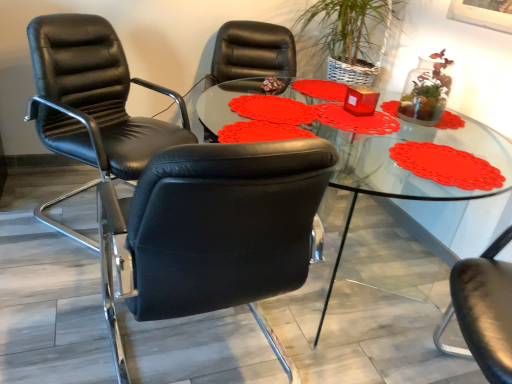
Question: From the image's perspective, is transparent glass table at center beneath black leather chair at left, marked as the first chair in a front-to-back arrangement?

Choices:
 (A) yes
 (B) no

Answer: (B)

Question: Is the surface of transparent glass table at center in direct contact with black leather chair at left, the second chair viewed from the back?

Choices:
 (A) yes
 (B) no

Answer: (B)

Question: Is black leather chair at left, marked as the first chair in a front-to-back arrangement, inside transparent glass table at center?

Choices:
 (A) no
 (B) yes

Answer: (A)

Question: From a real-world perspective, does transparent glass table at center sit lower than black leather chair at left, marked as the first chair in a front-to-back arrangement?

Choices:
 (A) yes
 (B) no

Answer: (A)

Question: Is transparent glass table at center at the right side of black leather chair at left, the second chair viewed from the back?

Choices:
 (A) yes
 (B) no

Answer: (A)

Question: Based on their positions, is black leather chair at left, which is the 2th chair from front to back, located to the left or right of black leather chair at left, marked as the first chair in a front-to-back arrangement?

Choices:
 (A) left
 (B) right

Answer: (A)

Question: From a real-world perspective, is black leather chair at left, the 1th chair when ordered from back to front, positioned above or below black leather chair at left, marked as the first chair in a front-to-back arrangement?

Choices:
 (A) above
 (B) below

Answer: (A)

Question: Is point (51, 29) positioned closer to the camera than point (249, 192)?

Choices:
 (A) closer
 (B) farther

Answer: (B)

Question: Considering their positions, is black leather chair at left, the 1th chair when ordered from back to front, located in front of or behind black leather chair at left, the second chair viewed from the back?

Choices:
 (A) behind
 (B) front

Answer: (A)

Question: From a real-world perspective, is black leather chair at left, the 1th chair when ordered from back to front, positioned above or below transparent glass table at center?

Choices:
 (A) below
 (B) above

Answer: (B)

Question: Is black leather chair at left, which is the 2th chair from front to back, to the left or to the right of transparent glass table at center in the image?

Choices:
 (A) right
 (B) left

Answer: (B)

Question: In terms of height, does black leather chair at left, the 1th chair when ordered from back to front, look taller or shorter compared to transparent glass table at center?

Choices:
 (A) short
 (B) tall

Answer: (B)

Question: From the image's perspective, is black leather chair at left, the 1th chair when ordered from back to front, above or below transparent glass table at center?

Choices:
 (A) above
 (B) below

Answer: (A)

Question: Visually, is black leather chair at left, marked as the first chair in a front-to-back arrangement, positioned to the left or to the right of transparent glass table at center?

Choices:
 (A) left
 (B) right

Answer: (A)

Question: From their relative heights in the image, would you say black leather chair at left, marked as the first chair in a front-to-back arrangement, is taller or shorter than transparent glass table at center?

Choices:
 (A) short
 (B) tall

Answer: (B)